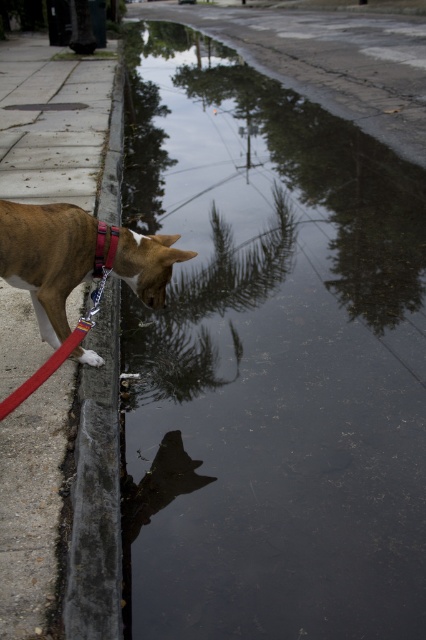
Question: Does glossy reflective water at lower center appear under concrete at left?

Choices:
 (A) no
 (B) yes

Answer: (A)

Question: Which of the following is the farthest from the observer?

Choices:
 (A) concrete at left
 (B) brown matte dog at left
 (C) leather-like brown neckband at left
 (D) glossy reflective water at lower center

Answer: (C)

Question: Which object is closer to the camera taking this photo?

Choices:
 (A) leather-like brown neckband at left
 (B) glossy reflective water at lower center

Answer: (B)

Question: Is brown matte dog at left thinner than leather-like brown neckband at left?

Choices:
 (A) no
 (B) yes

Answer: (A)

Question: Which object appears closest to the camera in this image?

Choices:
 (A) brown matte dog at left
 (B) concrete at left

Answer: (B)

Question: Does glossy reflective water at lower center have a larger size compared to brown matte dog at left?

Choices:
 (A) no
 (B) yes

Answer: (B)